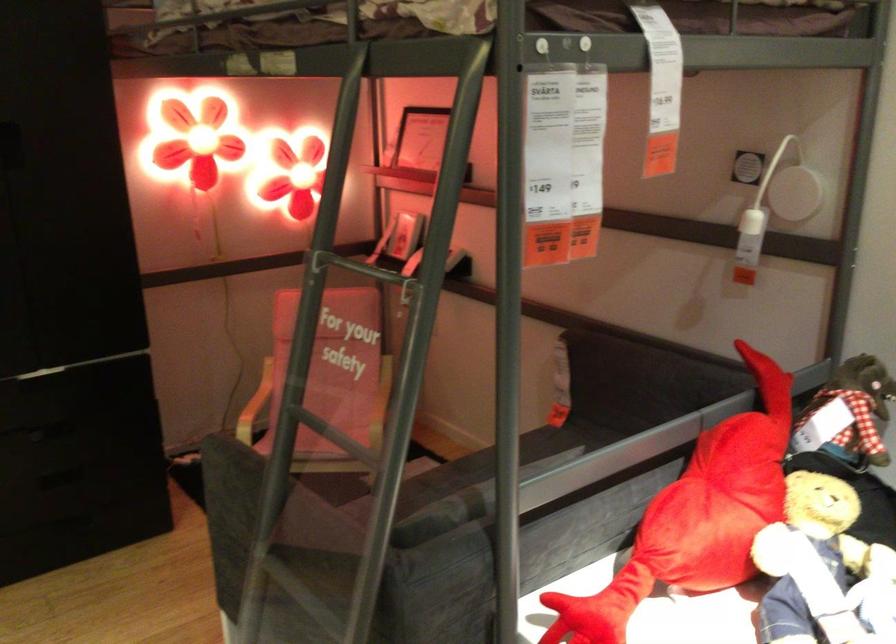
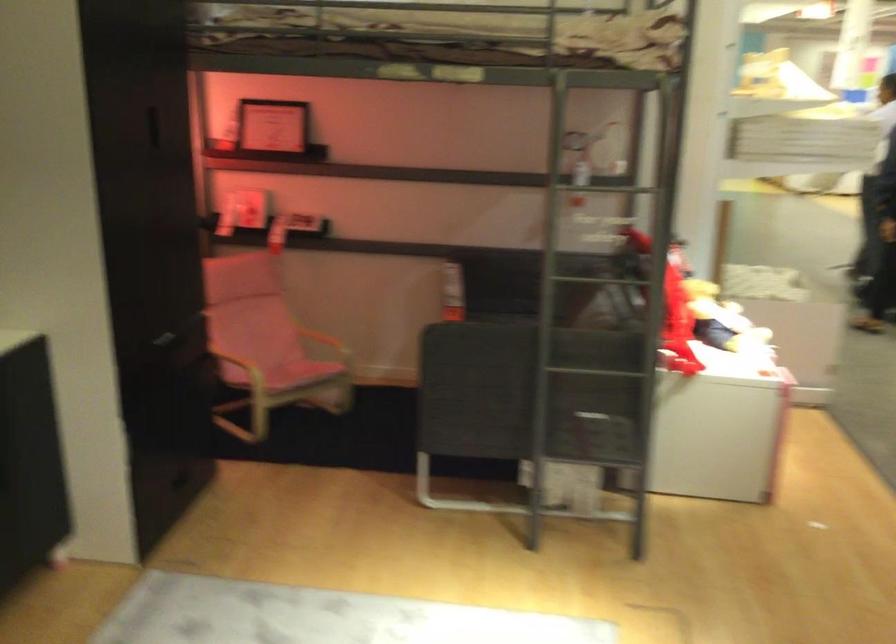
Find the pixel in the second image that matches (579,559) in the first image.

(677, 325)